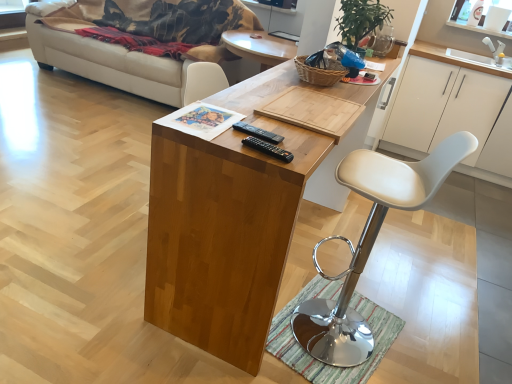
Locate an element on the screen. white leather stool at center is located at coordinates (370, 243).

What is the approximate height of white leather stool at center?

It is 3.44 feet.

What do you see at coordinates (139, 52) in the screenshot? This screenshot has width=512, height=384. I see `beige fabric couch at left` at bounding box center [139, 52].

Describe the element at coordinates (317, 74) in the screenshot. I see `woven brown basket at upper center` at that location.

Consider the image. Measure the distance between black plastic remote at center, placed as the first remote when sorted from back to front, and camera.

black plastic remote at center, placed as the first remote when sorted from back to front, and camera are 1.37 meters apart.

What are the coordinates of `black plastic remote at center, placed as the first remote when sorted from back to front` in the screenshot? It's located at (258, 132).

What is the approximate width of black plastic remote at center, marked as the second remote in a back-to-front arrangement?

2.24 inches.

Find the location of `white matte cabinet at right`. white matte cabinet at right is located at coordinates pos(454,109).

Locate an element on the screen. This screenshot has width=512, height=384. white leather stool at center is located at coordinates (370, 243).

Considering the relative sizes of white matte cabinet at right and white leather stool at center in the image provided, is white matte cabinet at right bigger than white leather stool at center?

Yes.

From the image's perspective, which is above, white matte cabinet at right or white leather stool at center?

white matte cabinet at right is shown above in the image.

In terms of height, does white matte cabinet at right look taller or shorter compared to white leather stool at center?

Clearly, white matte cabinet at right is shorter compared to white leather stool at center.

Does point (480, 122) lie behind point (372, 153)?

Yes, it is.

Between white leather stool at center and woven brown basket at upper center, which one appears on the right side from the viewer's perspective?

From the viewer's perspective, white leather stool at center appears more on the right side.

Between white leather stool at center and woven brown basket at upper center, which one is positioned in front?

white leather stool at center is closer to the camera.

What's the angular difference between wooden desk at center and black plastic remote at center, marked as the second remote in a back-to-front arrangement,'s facing directions?

98.6 degrees separate the facing orientations of wooden desk at center and black plastic remote at center, marked as the second remote in a back-to-front arrangement.

Considering the sizes of wooden desk at center and black plastic remote at center, the 1th remote in the front-to-back sequence, in the image, is wooden desk at center taller or shorter than black plastic remote at center, the 1th remote in the front-to-back sequence,?

In the image, wooden desk at center appears to be taller than black plastic remote at center, the 1th remote in the front-to-back sequence.

Consider the image. From a real-world perspective, does wooden desk at center sit lower than black plastic remote at center, marked as the second remote in a back-to-front arrangement?

Yes, from a real-world perspective, wooden desk at center is below black plastic remote at center, marked as the second remote in a back-to-front arrangement.

Are wooden desk at center and black plastic remote at center, marked as the second remote in a back-to-front arrangement, making contact?

wooden desk at center and black plastic remote at center, marked as the second remote in a back-to-front arrangement, are clearly separated.

Would you say beige fabric couch at left is a long distance from white leather stool at center?

Indeed, beige fabric couch at left is not near white leather stool at center.

Which object is thinner, beige fabric couch at left or white leather stool at center?

white leather stool at center is thinner.

Is beige fabric couch at left oriented away from white leather stool at center?

No, beige fabric couch at left's orientation is not away from white leather stool at center.

Based on the photo, from a real-world perspective, does beige fabric couch at left sit lower than white leather stool at center?

Yes, from a real-world perspective, beige fabric couch at left is under white leather stool at center.

Between white leather stool at center and black plastic remote at center, marked as the second remote in a back-to-front arrangement, which one has larger width?

With larger width is white leather stool at center.

Between white leather stool at center and black plastic remote at center, marked as the second remote in a back-to-front arrangement, which one has smaller size?

black plastic remote at center, marked as the second remote in a back-to-front arrangement.

Does white leather stool at center come in front of black plastic remote at center, marked as the second remote in a back-to-front arrangement?

Yes, it is in front of black plastic remote at center, marked as the second remote in a back-to-front arrangement.

Consider the image. Is white leather stool at center not inside black plastic remote at center, marked as the second remote in a back-to-front arrangement?

Yes, white leather stool at center is not within black plastic remote at center, marked as the second remote in a back-to-front arrangement.

Are black plastic remote at center, marked as the second remote in a back-to-front arrangement, and white matte cabinet at right far apart?

Yes, black plastic remote at center, marked as the second remote in a back-to-front arrangement, is far from white matte cabinet at right.

Considering the positions of points (276, 150) and (511, 145), is point (276, 150) closer to camera compared to point (511, 145)?

Yes, it is in front of point (511, 145).

From the white matte cabinet at right, count 2nd remotes forward and point to it. Please provide its 2D coordinates.

[(268, 148)]

Is black plastic remote at center, marked as the second remote in a back-to-front arrangement, taller than white matte cabinet at right?

No.

Which is more distant, (316, 79) or (249, 131)?

The point (316, 79) is more distant.

Is woven brown basket at upper center outside of black plastic remote at center, placed as the first remote when sorted from back to front?

woven brown basket at upper center is positioned outside black plastic remote at center, placed as the first remote when sorted from back to front.

Between woven brown basket at upper center and black plastic remote at center, placed as the first remote when sorted from back to front, which one has larger width?

woven brown basket at upper center is wider.

Measure the distance from woven brown basket at upper center to black plastic remote at center, arranged as the 2th remote when viewed from the front.

woven brown basket at upper center and black plastic remote at center, arranged as the 2th remote when viewed from the front, are 29.05 inches apart from each other.

I want to click on cabinetry that appears below the white leather stool at center (from a real-world perspective), so click(x=454, y=109).

The height and width of the screenshot is (384, 512). I want to click on chair below the woven brown basket at upper center (from the image's perspective), so click(x=370, y=243).

Considering their positions, is beige fabric couch at left positioned further to striped fabric mat at lower center than wooden desk at center?

beige fabric couch at left is positioned further to the anchor striped fabric mat at lower center.

Based on their spatial positions, is white matte cabinet at right or wooden desk at center further from beige fabric couch at left?

The object further to beige fabric couch at left is wooden desk at center.

From the picture: Considering their positions, is black plastic remote at center, marked as the second remote in a back-to-front arrangement, positioned closer to woven brown basket at upper center than wooden desk at center?

wooden desk at center lies closer to woven brown basket at upper center than the other object.

Based on their spatial positions, is beige fabric couch at left or black plastic remote at center, placed as the first remote when sorted from back to front, closer to white matte cabinet at right?

beige fabric couch at left.

From the image, which object appears to be nearer to white matte cabinet at right, beige fabric couch at left or white leather stool at center?

white leather stool at center is positioned closer to the anchor white matte cabinet at right.

From the image, which object appears to be farther from woven brown basket at upper center, black plastic remote at center, placed as the first remote when sorted from back to front, or black plastic remote at center, the 1th remote in the front-to-back sequence?

black plastic remote at center, the 1th remote in the front-to-back sequence, is further to woven brown basket at upper center.

From the image, which object appears to be farther from striped fabric mat at lower center, woven brown basket at upper center or black plastic remote at center, the 1th remote in the front-to-back sequence?

woven brown basket at upper center is positioned further to the anchor striped fabric mat at lower center.

When comparing their distances from black plastic remote at center, the 1th remote in the front-to-back sequence, does striped fabric mat at lower center or woven brown basket at upper center seem closer?

Based on the image, woven brown basket at upper center appears to be nearer to black plastic remote at center, the 1th remote in the front-to-back sequence.

The width and height of the screenshot is (512, 384). In order to click on chair between wooden desk at center and woven brown basket at upper center from front to back in this screenshot , I will do `click(370, 243)`.

Where is `mat between white leather stool at center and white matte cabinet at right in the front-back direction`? mat between white leather stool at center and white matte cabinet at right in the front-back direction is located at coordinates (325, 363).

Locate an element on the screen. The width and height of the screenshot is (512, 384). mat positioned between wooden desk at center and white matte cabinet at right from near to far is located at coordinates (325, 363).

Locate an element on the screen. The height and width of the screenshot is (384, 512). chair between beige fabric couch at left and striped fabric mat at lower center from top to bottom is located at coordinates (370, 243).